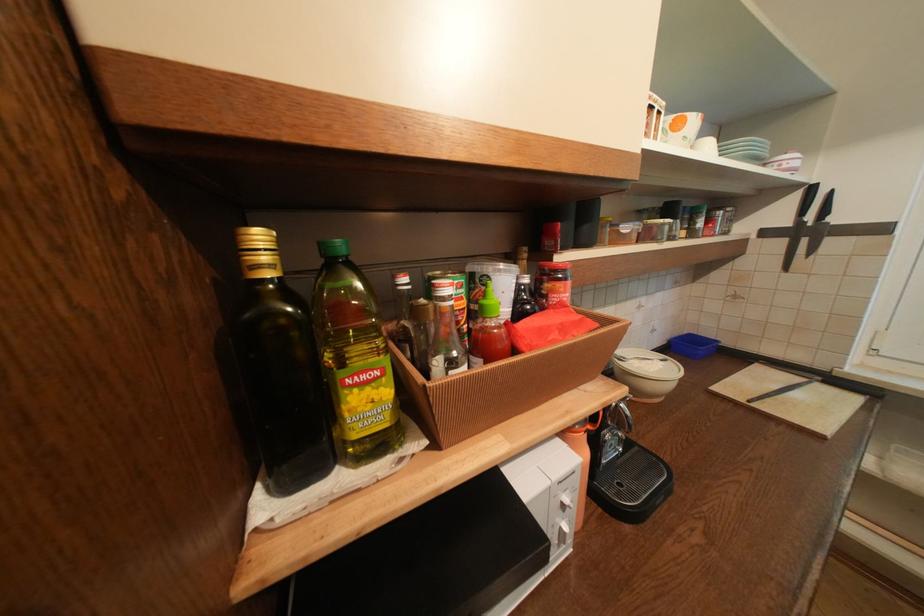
I want to click on gold bottle cap, so click(x=258, y=252).